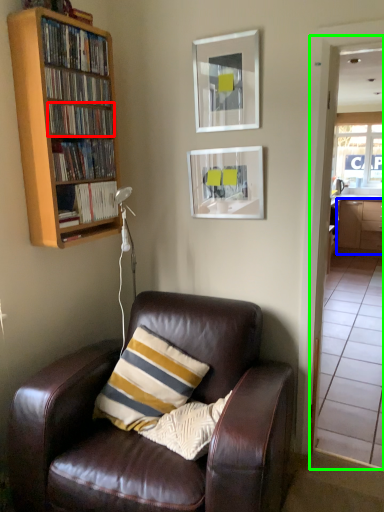
Question: Which object is positioned closest to book (highlighted by a red box)? Select from cabinetry (highlighted by a blue box) and glass door (highlighted by a green box).

Choices:
 (A) cabinetry
 (B) glass door

Answer: (B)